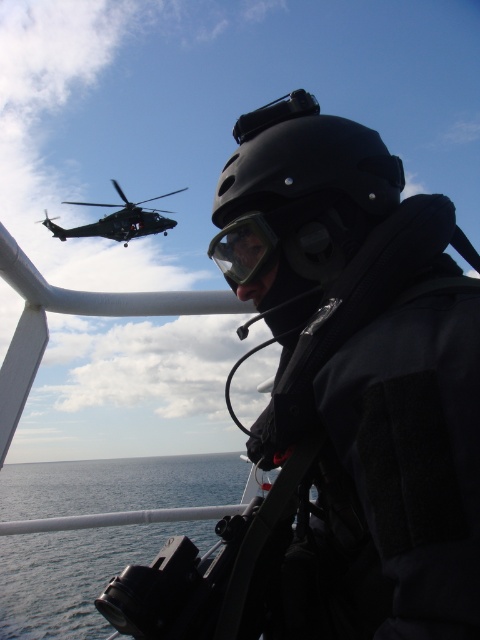
You are a photographer trying to capture the transparent plastic goggles at center and the dark gray matte helicopter at upper left in the same frame. Which object would you need to zoom in on more to ensure it appears larger in your photo?

The transparent plastic goggles at center has a smaller size compared to the dark gray matte helicopter at upper left, so you would need to zoom in more on the transparent plastic goggles at center to make it appear larger in the photo.